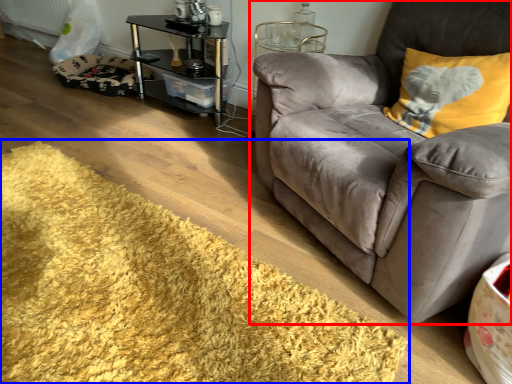
Question: Which object is closer to the camera taking this photo, studio couch (highlighted by a red box) or mat (highlighted by a blue box)?

Choices:
 (A) studio couch
 (B) mat

Answer: (B)